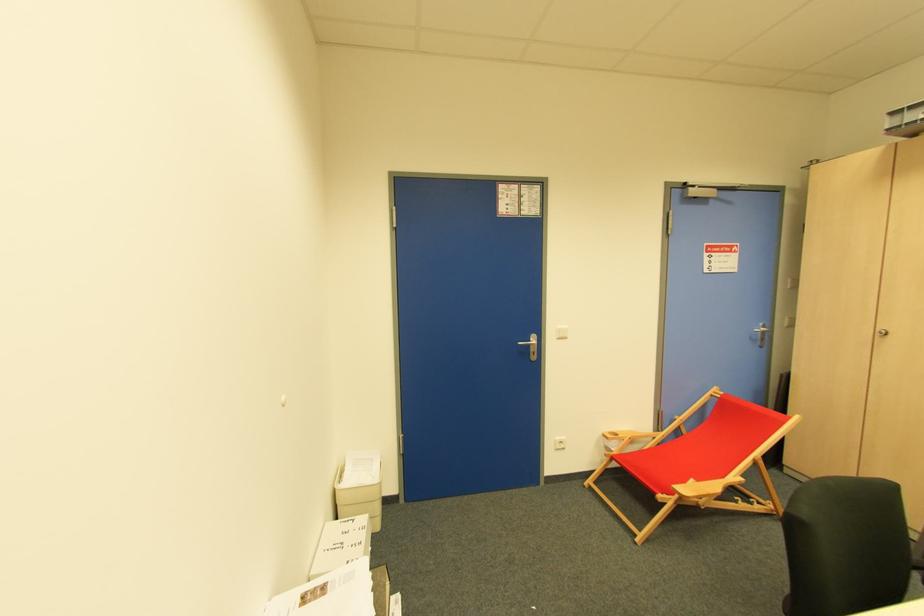
Describe the element at coordinates (881, 331) in the screenshot. I see `a silver cabinet knob` at that location.